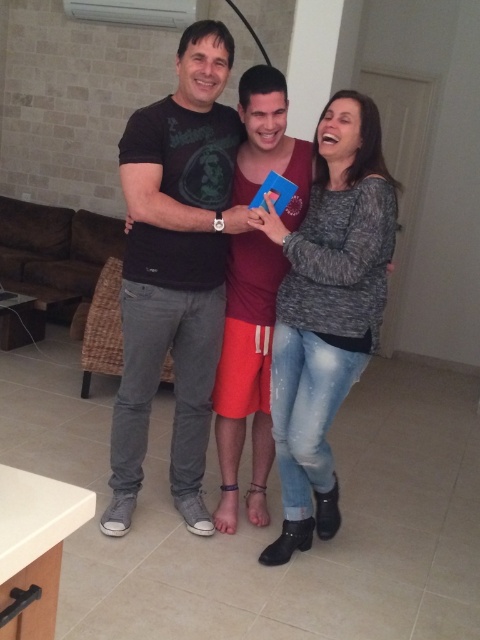
You are organizing a clothing donation drive and need to stack the gray knit sweater at center and the matte black shirt at center vertically. Based on their heights, which one should you place at the bottom to ensure stability?

The gray knit sweater at center has a lesser height compared to matte black shirt at center, so placing the shorter gray knit sweater at center at the bottom would provide a stable base for the taller matte black shirt at center on top.